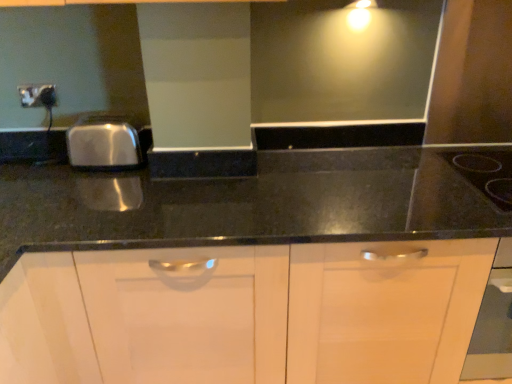
What is the approximate height of matte black outlet at upper left?

The height of matte black outlet at upper left is 3.55 inches.

Describe the element at coordinates (37, 96) in the screenshot. This screenshot has height=384, width=512. I see `matte black outlet at upper left` at that location.

At what (x,y) coordinates should I click in order to perform the action: click on matte black outlet at upper left. Please return your answer as a coordinate pair (x, y). Looking at the image, I should click on (37, 96).

Image resolution: width=512 pixels, height=384 pixels. I want to click on black glass gas stove at upper right, so click(x=486, y=173).

What do you see at coordinates (486, 173) in the screenshot? I see `black glass gas stove at upper right` at bounding box center [486, 173].

Image resolution: width=512 pixels, height=384 pixels. I want to click on matte black outlet at upper left, so click(x=37, y=96).

Does matte black outlet at upper left appear on the left side of black glass gas stove at upper right?

Yes.

Is matte black outlet at upper left positioned before black glass gas stove at upper right?

No, it is not.

Considering the points (49, 105) and (510, 188), which point is in front, point (49, 105) or point (510, 188)?

The point (510, 188) is closer.

From the image's perspective, is matte black outlet at upper left located above or below black glass gas stove at upper right?

matte black outlet at upper left is above black glass gas stove at upper right.

From a real-world perspective, which is physically below, matte black outlet at upper left or black glass gas stove at upper right?

From a 3D spatial view, black glass gas stove at upper right is below.

Considering the sizes of objects matte black outlet at upper left and black glass gas stove at upper right in the image provided, who is wider, matte black outlet at upper left or black glass gas stove at upper right?

black glass gas stove at upper right is wider.

Who is shorter, matte black outlet at upper left or black glass gas stove at upper right?

black glass gas stove at upper right.

Considering the sizes of objects matte black outlet at upper left and black glass gas stove at upper right in the image provided, who is bigger, matte black outlet at upper left or black glass gas stove at upper right?

Bigger between the two is black glass gas stove at upper right.

In the scene shown: Do you think matte black outlet at upper left is within black glass gas stove at upper right, or outside of it?

The correct answer is: outside.

Is there a large distance between matte black outlet at upper left and black glass gas stove at upper right?

Yes, matte black outlet at upper left and black glass gas stove at upper right are located far from each other.

Is matte black outlet at upper left facing towards black glass gas stove at upper right?

No, matte black outlet at upper left does not turn towards black glass gas stove at upper right.

How different are the orientations of matte black outlet at upper left and black glass gas stove at upper right in degrees?

The angular difference between matte black outlet at upper left and black glass gas stove at upper right is 0.44 degrees.

Measure the distance between matte black outlet at upper left and black glass gas stove at upper right.

matte black outlet at upper left is 5.24 feet from black glass gas stove at upper right.

Find the location of a particular element. The height and width of the screenshot is (384, 512). gas stove below the matte black outlet at upper left (from the image's perspective) is located at coordinates (486, 173).

Is black glass gas stove at upper right at the left side of matte black outlet at upper left?

No, black glass gas stove at upper right is not to the left of matte black outlet at upper left.

Does black glass gas stove at upper right lie behind matte black outlet at upper left?

No, it is not.

Considering the points (496, 193) and (20, 87), which point is behind, point (496, 193) or point (20, 87)?

The point (20, 87) is farther.

From the image's perspective, is black glass gas stove at upper right over matte black outlet at upper left?

Actually, black glass gas stove at upper right appears below matte black outlet at upper left in the image.

Consider the image. From a real-world perspective, is black glass gas stove at upper right located higher than matte black outlet at upper left?

Incorrect, from a real-world perspective, black glass gas stove at upper right is lower than matte black outlet at upper left.

Between black glass gas stove at upper right and matte black outlet at upper left, which one has larger width?

black glass gas stove at upper right.

Who is shorter, black glass gas stove at upper right or matte black outlet at upper left?

black glass gas stove at upper right is shorter.

Is black glass gas stove at upper right smaller than matte black outlet at upper left?

Incorrect, black glass gas stove at upper right is not smaller in size than matte black outlet at upper left.

In the scene shown: Is matte black outlet at upper left surrounded by black glass gas stove at upper right?

No, matte black outlet at upper left is not surrounded by black glass gas stove at upper right.

Is there a large distance between black glass gas stove at upper right and matte black outlet at upper left?

Indeed, black glass gas stove at upper right is not near matte black outlet at upper left.

Is black glass gas stove at upper right positioned with its back to matte black outlet at upper left?

No.

Can you tell me how much black glass gas stove at upper right and matte black outlet at upper left differ in facing direction?

0.44 degrees separate the facing orientations of black glass gas stove at upper right and matte black outlet at upper left.

Locate an element on the screen. The image size is (512, 384). gas stove below the matte black outlet at upper left (from the image's perspective) is located at coordinates (486, 173).

There is a black glass gas stove at upper right. Identify the location of electric outlet above it (from a real-world perspective). (37, 96).

I want to click on electric outlet above the black glass gas stove at upper right (from the image's perspective), so click(x=37, y=96).